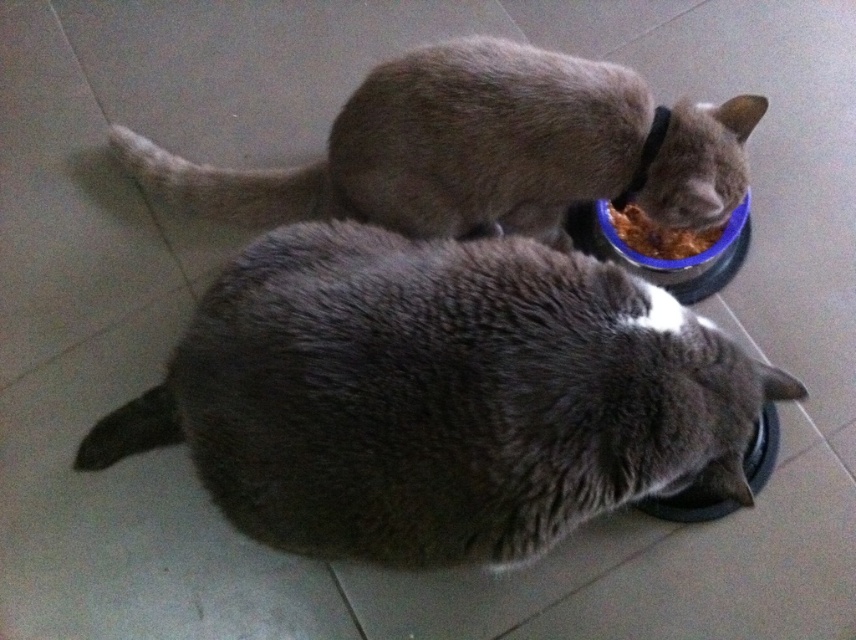
Question: Is gray fluffy cat at lower center wider than brown matte food at center?

Choices:
 (A) no
 (B) yes

Answer: (B)

Question: Does fuzzy gray cat at upper center lie in front of brown matte food at center?

Choices:
 (A) no
 (B) yes

Answer: (B)

Question: Can you confirm if fuzzy gray cat at upper center is positioned above blue plastic bowl at center?

Choices:
 (A) no
 (B) yes

Answer: (B)

Question: Which point is farther to the camera?

Choices:
 (A) (697, 243)
 (B) (471, 76)
 (C) (716, 257)

Answer: (A)

Question: Which object is the closest to the gray fluffy cat at lower center?

Choices:
 (A) brown matte food at center
 (B) blue plastic bowl at center
 (C) fuzzy gray cat at upper center

Answer: (C)

Question: Among these points, which one is farthest from the camera?

Choices:
 (A) (638, 243)
 (B) (235, 259)
 (C) (441, 124)

Answer: (B)